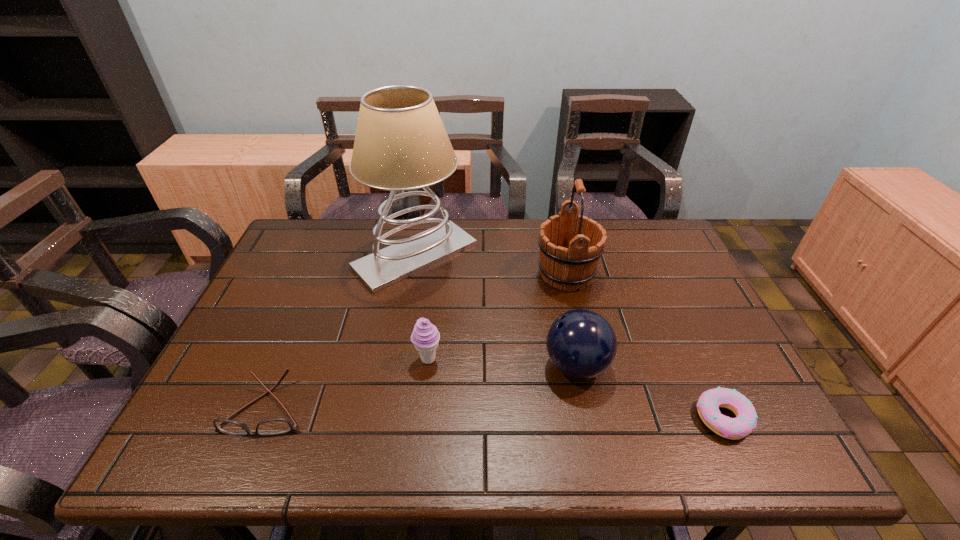
At what (x,y) coordinates should I click in order to perform the action: click on table lamp. Please return your answer as a coordinate pair (x, y). Looking at the image, I should click on (401, 144).

Where is `the second tallest object`? This screenshot has width=960, height=540. the second tallest object is located at coordinates (570, 246).

At what (x,y) coordinates should I click in order to perform the action: click on bowling ball. Please return your answer as a coordinate pair (x, y). The width and height of the screenshot is (960, 540). Looking at the image, I should click on (581, 344).

Identify the location of icecream. Image resolution: width=960 pixels, height=540 pixels. (425, 337).

You are a GUI agent. You are given a task and a screenshot of the screen. Output one action in this format:
    pyautogui.click(x=<x>, y=<y>)
    Task: Click on the spectacles
    The height and width of the screenshot is (540, 960).
    Given the screenshot: What is the action you would take?
    pyautogui.click(x=276, y=426)

Where is `the rightmost object`? the rightmost object is located at coordinates (708, 404).

Image resolution: width=960 pixels, height=540 pixels. I want to click on the shortest object, so click(708, 404).

Identify the location of free space located on the front of the table lamp. (400, 342).

This screenshot has width=960, height=540. Find the location of `free space located on the left of the wine bucket`. free space located on the left of the wine bucket is located at coordinates coord(419,274).

This screenshot has height=540, width=960. I want to click on free space located on the surface of the bowling ball near the finger holes, so click(419, 366).